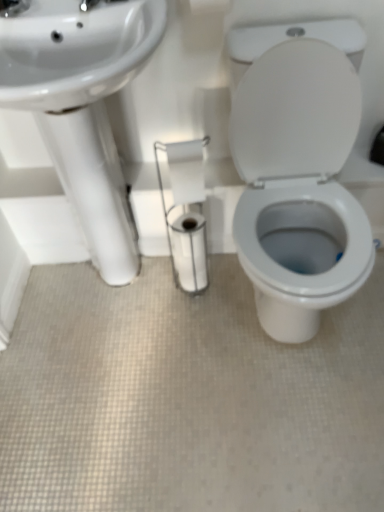
Question: Does white glossy sink at left touch white glossy porcelain at center?

Choices:
 (A) yes
 (B) no

Answer: (B)

Question: Can you confirm if white glossy sink at left is smaller than white glossy porcelain at center?

Choices:
 (A) yes
 (B) no

Answer: (B)

Question: Is white glossy sink at left further to the viewer compared to white glossy porcelain at center?

Choices:
 (A) no
 (B) yes

Answer: (B)

Question: Does white glossy sink at left have a larger size compared to white glossy porcelain at center?

Choices:
 (A) yes
 (B) no

Answer: (A)

Question: Can you confirm if white glossy sink at left is thinner than white glossy porcelain at center?

Choices:
 (A) no
 (B) yes

Answer: (B)

Question: Could you tell me if white glossy sink at left is facing white glossy porcelain at center?

Choices:
 (A) no
 (B) yes

Answer: (A)

Question: Is white glossy porcelain at center further to the viewer compared to white glossy sink at left?

Choices:
 (A) no
 (B) yes

Answer: (A)

Question: From the image's perspective, is white glossy porcelain at center over white glossy sink at left?

Choices:
 (A) no
 (B) yes

Answer: (A)

Question: From a real-world perspective, is white glossy porcelain at center positioned under white glossy sink at left based on gravity?

Choices:
 (A) no
 (B) yes

Answer: (B)

Question: Is white glossy porcelain at center oriented towards white glossy sink at left?

Choices:
 (A) no
 (B) yes

Answer: (A)

Question: Are white glossy porcelain at center and white glossy sink at left beside each other?

Choices:
 (A) no
 (B) yes

Answer: (A)

Question: Considering the relative sizes of white glossy porcelain at center and white glossy sink at left in the image provided, is white glossy porcelain at center taller than white glossy sink at left?

Choices:
 (A) yes
 (B) no

Answer: (B)

Question: Is white glossy toilet paper at center, the 1th toilet paper positioned from the bottom, aimed at white glossy porcelain at center?

Choices:
 (A) no
 (B) yes

Answer: (A)